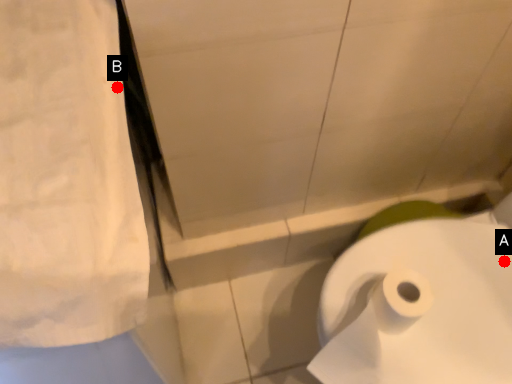
Question: Two points are circled on the image, labeled by A and B beside each circle. Which point is farther to the camera?

Choices:
 (A) A is further
 (B) B is further

Answer: (A)